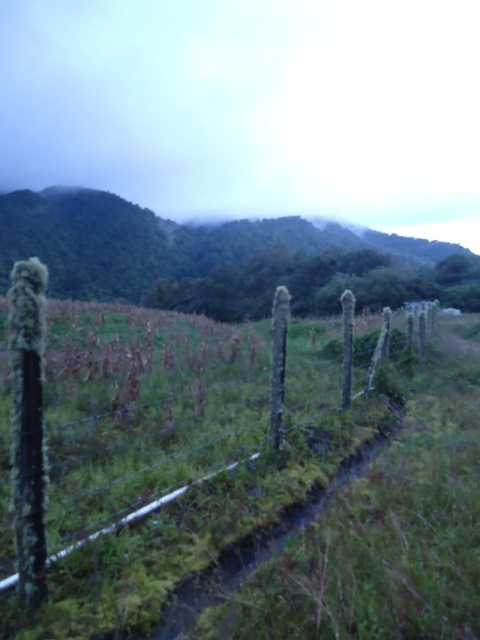
Can you confirm if green mossy wood fence at center is taller than green mossy fence at lower left?

In fact, green mossy wood fence at center may be shorter than green mossy fence at lower left.

Identify the location of green mossy wood fence at center. (179, 451).

Where is `green mossy wood fence at center`? Image resolution: width=480 pixels, height=640 pixels. green mossy wood fence at center is located at coordinates (179, 451).